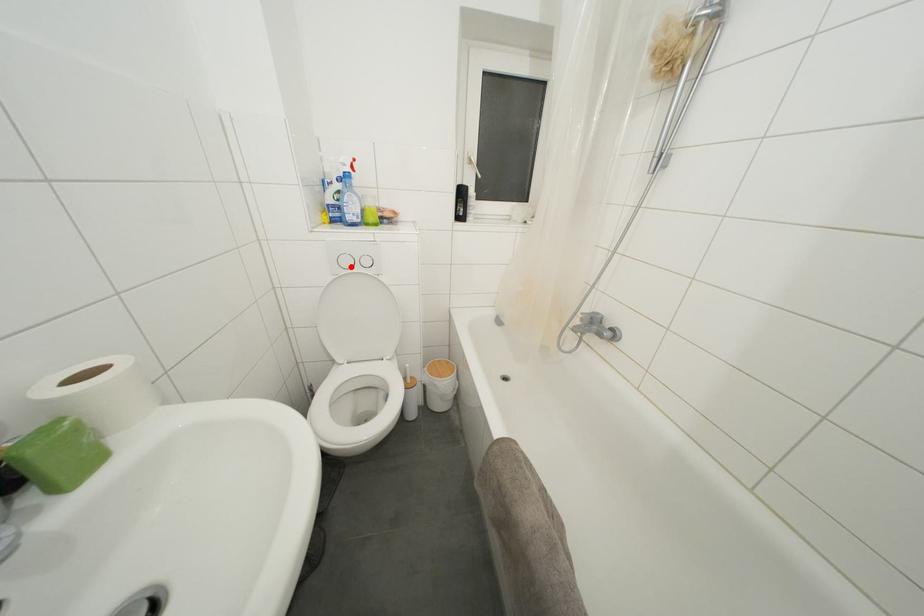
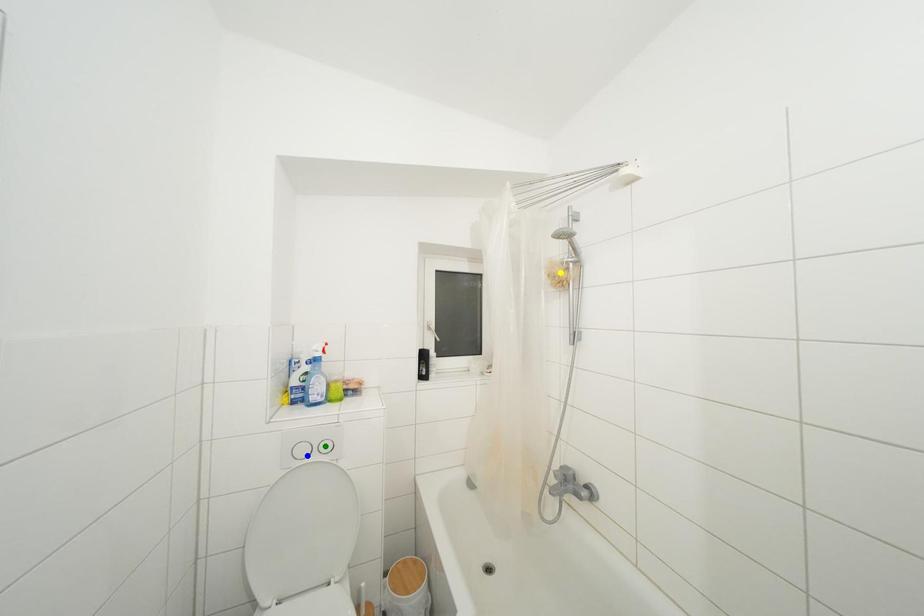
Question: I am providing you with two images of the same scene from different viewpoints. A red point is marked on the first image. You are given multiple points on the second image. Which mark in image 2 goes with the point in image 1?

Choices:
 (A) blue point
 (B) yellow point
 (C) green point

Answer: (A)